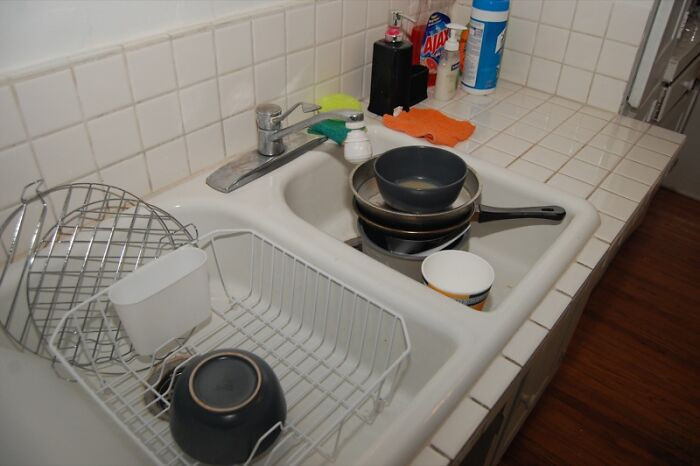
Locate an element on the screen. This screenshot has height=466, width=700. dish towel is located at coordinates (428, 130).